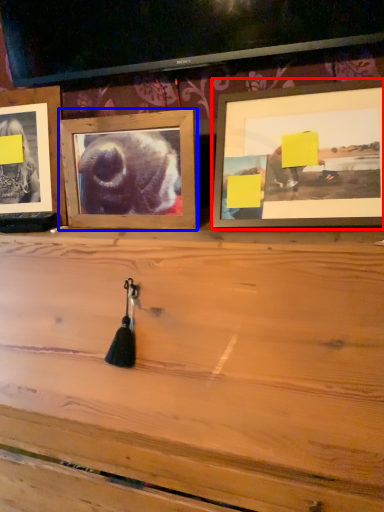
Question: Among these objects, which one is nearest to the camera, picture frame (highlighted by a red box) or picture frame (highlighted by a blue box)?

Choices:
 (A) picture frame
 (B) picture frame

Answer: (A)